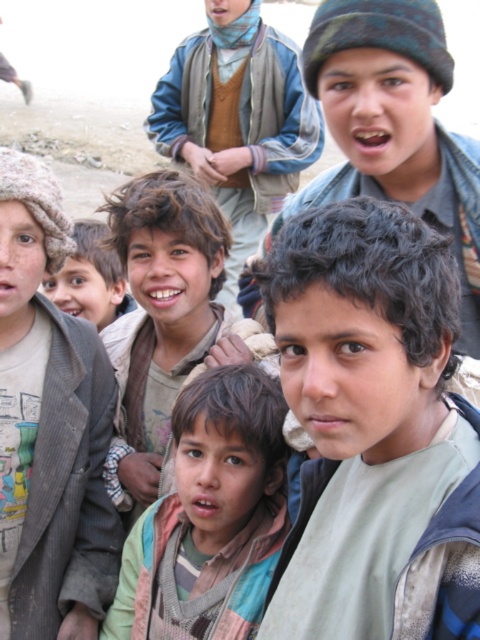
Question: Estimate the real-world distances between objects in this image. Which object is farther from the light brown fabric shirt at center?

Choices:
 (A) matte green beanie at upper right
 (B) brown woolen scarf at center
 (C) multicolored fabric shirt at center

Answer: (B)

Question: Which point appears farthest from the camera in this image?

Choices:
 (A) (333, 186)
 (B) (207, 147)
 (C) (251, 435)
 (D) (441, 470)

Answer: (B)

Question: Can you confirm if light brown fabric shirt at center is positioned below brown woolen scarf at center?

Choices:
 (A) no
 (B) yes

Answer: (B)

Question: Which object is the closest to the light brown woolen hat at left?

Choices:
 (A) matte green beanie at upper right
 (B) multicolored fabric shirt at center
 (C) brown woolen scarf at center
 (D) light brown fabric shirt at center

Answer: (B)

Question: Does light brown woolen hat at left come behind multicolored fabric shirt at center?

Choices:
 (A) yes
 (B) no

Answer: (A)

Question: Is light brown fabric shirt at center above brown woolen scarf at center?

Choices:
 (A) yes
 (B) no

Answer: (B)